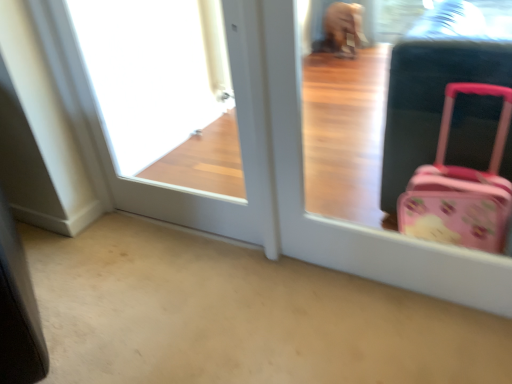
Question: Does point (152, 175) appear closer or farther from the camera than point (285, 92)?

Choices:
 (A) closer
 (B) farther

Answer: (B)

Question: Relative to pink plastic suitcase at right, is white glossy door at upper left in front or behind?

Choices:
 (A) behind
 (B) front

Answer: (A)

Question: Considering the positions of white glossy door at upper left and pink plastic suitcase at right in the image, is white glossy door at upper left taller or shorter than pink plastic suitcase at right?

Choices:
 (A) short
 (B) tall

Answer: (B)

Question: Relative to white glossy door at upper left, is pink plastic suitcase at right in front or behind?

Choices:
 (A) front
 (B) behind

Answer: (A)

Question: Is pink plastic suitcase at right to the left or to the right of white glossy door at upper left in the image?

Choices:
 (A) left
 (B) right

Answer: (B)

Question: Would you say pink plastic suitcase at right is inside or outside white glossy door at upper left?

Choices:
 (A) inside
 (B) outside

Answer: (B)

Question: In terms of height, does pink plastic suitcase at right look taller or shorter compared to white glossy door at upper left?

Choices:
 (A) tall
 (B) short

Answer: (B)